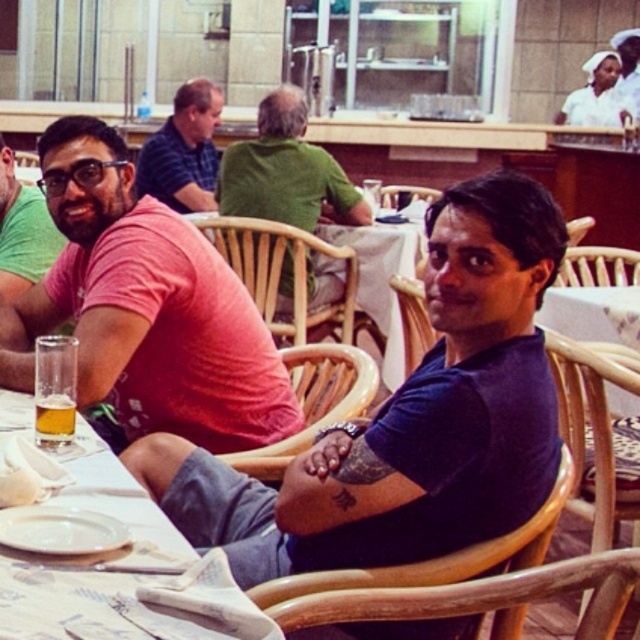
You are a waiter in a restaurant and need to deliver a dessert to the table where the pink matte shirt at center and the clear glass at lower left are located. The dessert plate is 30 centimeters in diameter. Can you place the dessert between these two items without touching either of them?

The pink matte shirt at center and clear glass at lower left are 52.20 centimeters apart. Since the dessert plate is 30 centimeters wide, there is enough space between them to place the dessert without touching either item.

You are a waiter at the restaurant and need to deliver a dessert to the table. The dessert should be placed between the pink matte shirt at center and the clear glass at lower left. Can you place it there?

The pink matte shirt at center is to the left of the clear glass at lower left, so the dessert can be placed between them.

You are a photographer setting up a shoot in this dining area. You need to position a backdrop that should be at the same height as the tallest between the green matte shirt at center and smooth white shirt at center. Which shirt should you use to determine the backdrop height?

The green matte shirt at center has a greater height compared to the smooth white shirt at center, so the backdrop should be set to match the height of the green matte shirt at center.